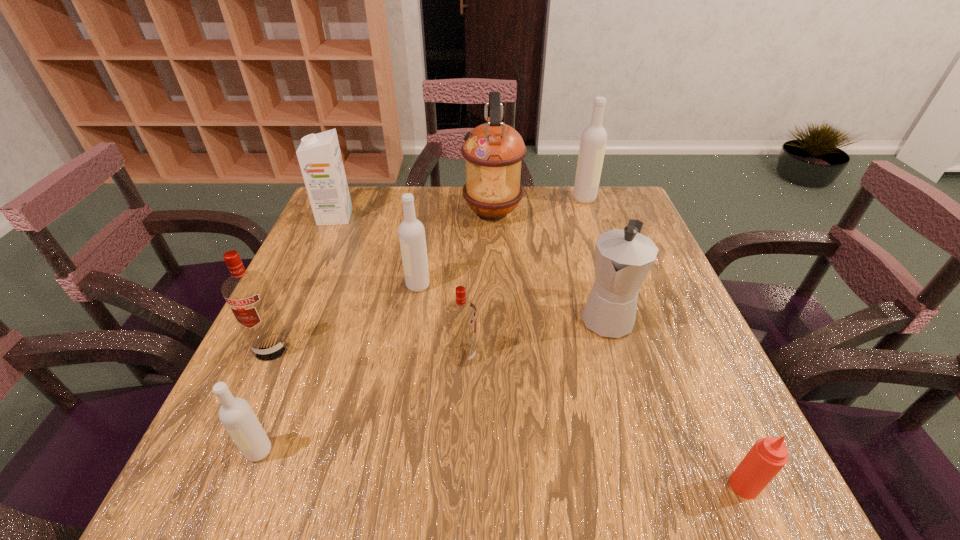
Find the location of a particular element. The image size is (960, 540). oil lamp is located at coordinates (493, 151).

This screenshot has width=960, height=540. I want to click on the tallest vodka, so click(x=593, y=141).

Find the location of a particular element. the farthest vodka is located at coordinates (593, 141).

Locate an element on the screen. The width and height of the screenshot is (960, 540). carton is located at coordinates (319, 155).

Locate an element on the screen. The height and width of the screenshot is (540, 960). coffeepot is located at coordinates (623, 258).

Where is `the second white vodka from left to right`? the second white vodka from left to right is located at coordinates (411, 231).

Locate an element on the screen. the fourth object from left to right is located at coordinates (411, 231).

Where is `the bigger red vodka`? the bigger red vodka is located at coordinates (247, 293).

Identify the location of the right red vodka. This screenshot has height=540, width=960. (461, 314).

Where is `the smaller red vodka`? The width and height of the screenshot is (960, 540). the smaller red vodka is located at coordinates (461, 314).